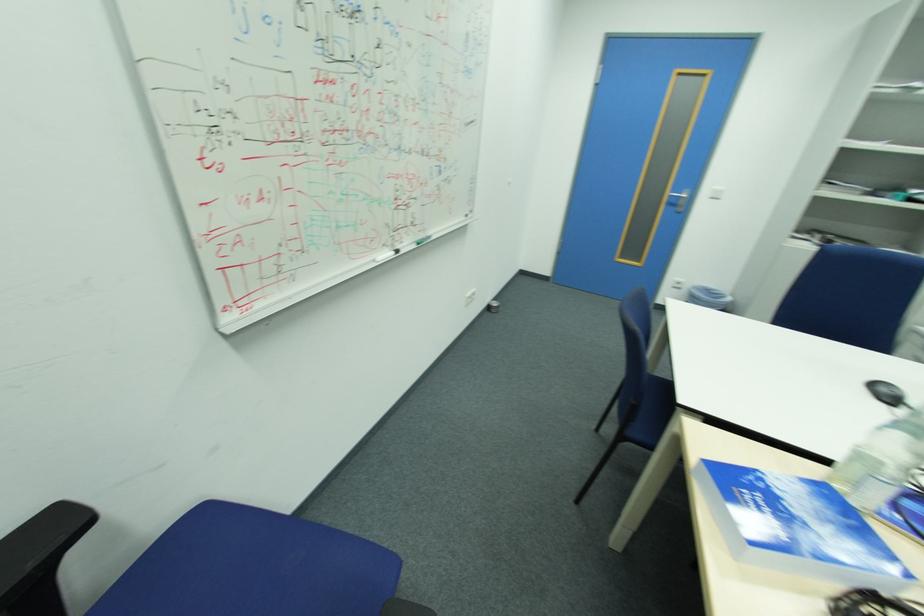
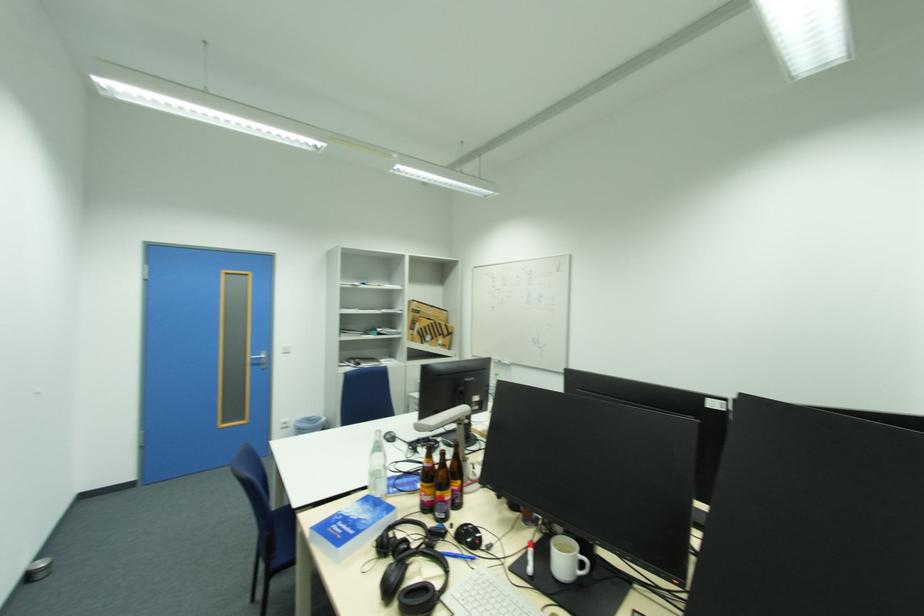
In the second image, find the point that corresponds to (x=723, y=188) in the first image.

(289, 347)